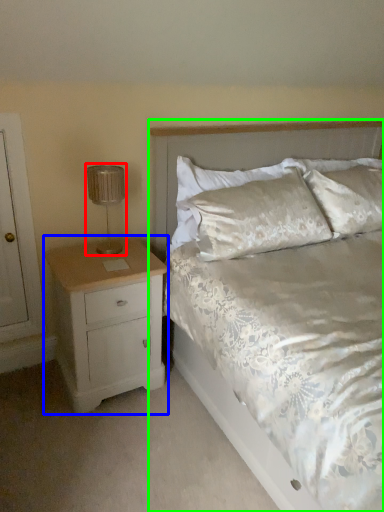
Question: Estimate the real-world distances between objects in this image. Which object is closer to lamp (highlighted by a red box), nightstand (highlighted by a blue box) or bed (highlighted by a green box)?

Choices:
 (A) nightstand
 (B) bed

Answer: (A)